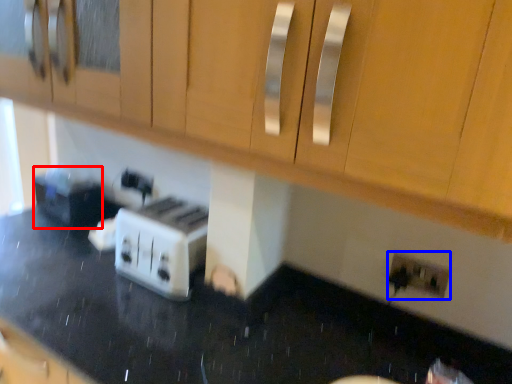
Question: Which of the following is the farthest to the observer, appliance (highlighted by a red box) or electric outlet (highlighted by a blue box)?

Choices:
 (A) appliance
 (B) electric outlet

Answer: (A)